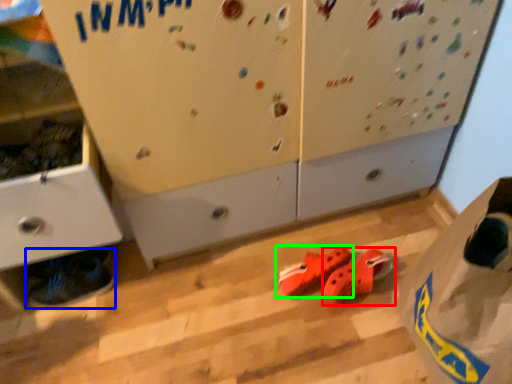
Question: Which is nearer to the footwear (highlighted by a red box)? footwear (highlighted by a blue box) or footwear (highlighted by a green box).

Choices:
 (A) footwear
 (B) footwear

Answer: (B)